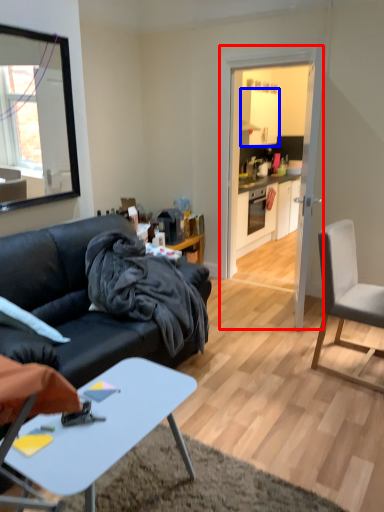
Question: Which object appears closest to the camera in this image, glass door (highlighted by a red box) or cabinetry (highlighted by a blue box)?

Choices:
 (A) glass door
 (B) cabinetry

Answer: (A)